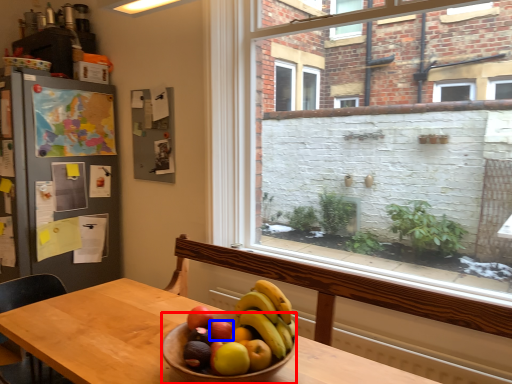
Question: Which object appears farthest to the camera in this image, bowl (highlighted by a red box) or apple (highlighted by a blue box)?

Choices:
 (A) bowl
 (B) apple

Answer: (B)